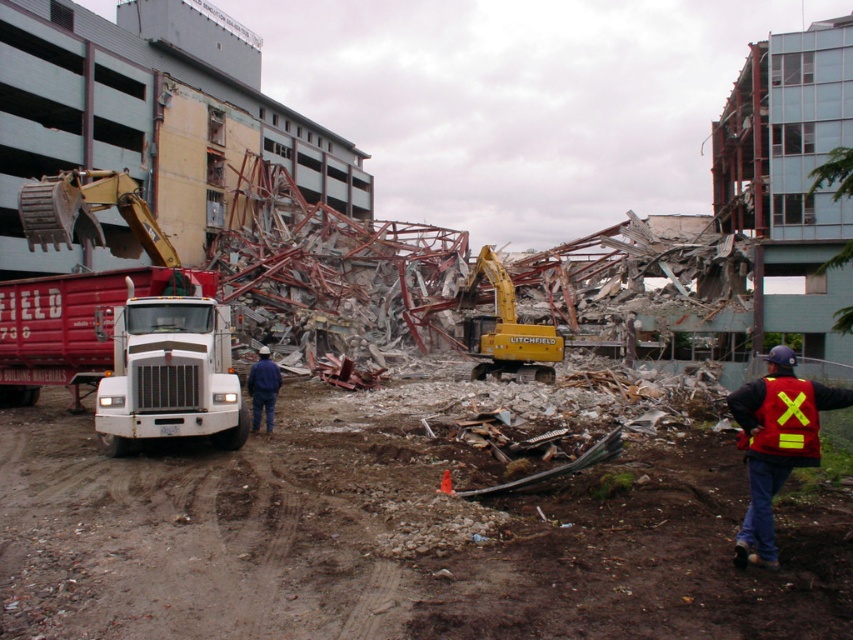
Question: Is yellow rubber excavator at center bigger than reflective red safety vest at lower right?

Choices:
 (A) yes
 (B) no

Answer: (A)

Question: Among these points, which one is farthest from the camera?

Choices:
 (A) pos(767,449)
 (B) pos(155,404)
 (C) pos(259,362)
 (D) pos(793,362)

Answer: (C)

Question: Among these objects, which one is nearest to the camera?

Choices:
 (A) white matte trailer truck at left
 (B) reflective red safety vest at lower right
 (C) yellow rubber excavator at center
 (D) blue denim jeans at center

Answer: (B)

Question: Which object is closer to the camera taking this photo?

Choices:
 (A) yellow rubber excavator at center
 (B) reflective red safety vest at lower right
 (C) white matte trailer truck at left
 (D) blue denim jeans at center

Answer: (B)

Question: Does yellow rubber excavator at center have a greater width compared to blue denim jeans at center?

Choices:
 (A) no
 (B) yes

Answer: (A)

Question: Is yellow rubber excavator at center above reflective red safety vest at lower right?

Choices:
 (A) no
 (B) yes

Answer: (B)